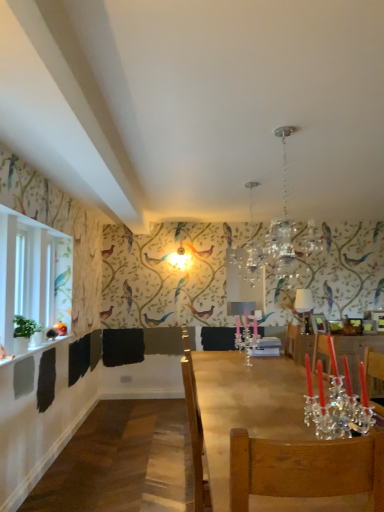
Question: Does clear crystal candle holder at center contain wooden table at center?

Choices:
 (A) yes
 (B) no

Answer: (B)

Question: Is clear crystal candle holder at center behind wooden table at center?

Choices:
 (A) yes
 (B) no

Answer: (A)

Question: Is clear crystal candle holder at center bigger than wooden table at center?

Choices:
 (A) yes
 (B) no

Answer: (B)

Question: From the image's perspective, is clear crystal candle holder at center under wooden table at center?

Choices:
 (A) no
 (B) yes

Answer: (B)

Question: Is clear crystal candle holder at center outside wooden table at center?

Choices:
 (A) yes
 (B) no

Answer: (A)

Question: From a real-world perspective, is clear crystal candle holder at center located beneath wooden table at center?

Choices:
 (A) no
 (B) yes

Answer: (A)

Question: Is white glossy lampshade at upper center not within crystal glass chandelier at upper center?

Choices:
 (A) no
 (B) yes

Answer: (B)

Question: Does white glossy lampshade at upper center turn towards crystal glass chandelier at upper center?

Choices:
 (A) yes
 (B) no

Answer: (B)

Question: Is white glossy lampshade at upper center smaller than crystal glass chandelier at upper center?

Choices:
 (A) yes
 (B) no

Answer: (A)

Question: From the image's perspective, is white glossy lampshade at upper center below crystal glass chandelier at upper center?

Choices:
 (A) no
 (B) yes

Answer: (B)

Question: Is white glossy lampshade at upper center bigger than crystal glass chandelier at upper center?

Choices:
 (A) yes
 (B) no

Answer: (B)

Question: Is white glossy lampshade at upper center taller than crystal glass chandelier at upper center?

Choices:
 (A) no
 (B) yes

Answer: (A)

Question: From the image's perspective, is clear crystal candle holder at center on top of crystal glass chandelier at upper center?

Choices:
 (A) yes
 (B) no

Answer: (B)